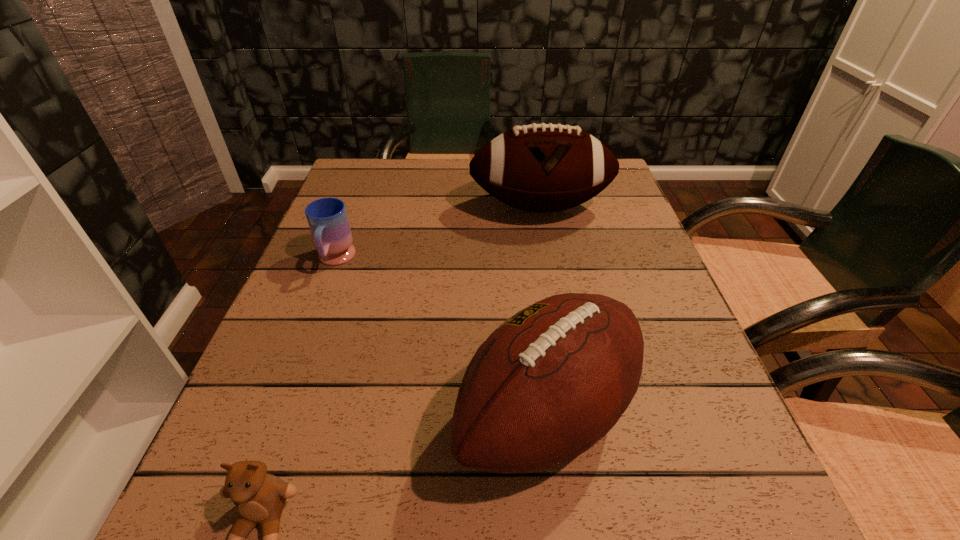
Locate an element on the screen. The width and height of the screenshot is (960, 540). the farthest object is located at coordinates (542, 168).

Identify the location of the nearer football (American). (551, 381).

What are the coordinates of `mug` in the screenshot? It's located at (327, 218).

Image resolution: width=960 pixels, height=540 pixels. I want to click on vacant area situated on the back of the farthest object, so click(532, 163).

Image resolution: width=960 pixels, height=540 pixels. What are the coordinates of `blank area located 0.170m on the left of the nearer football (American)` in the screenshot? It's located at (348, 415).

Where is `vacant area situated on the side of the mug with the handle`? This screenshot has width=960, height=540. vacant area situated on the side of the mug with the handle is located at coordinates (280, 405).

At what (x,y) coordinates should I click in order to perform the action: click on object located at the far edge. Please return your answer as a coordinate pair (x, y). The height and width of the screenshot is (540, 960). Looking at the image, I should click on (542, 168).

Locate an element on the screen. The image size is (960, 540). object positioned at the near edge is located at coordinates (551, 381).

Find the location of `object positioned at the left edge`. object positioned at the left edge is located at coordinates (327, 218).

Locate an element on the screen. The width and height of the screenshot is (960, 540). object that is at the far right corner is located at coordinates pos(542,168).